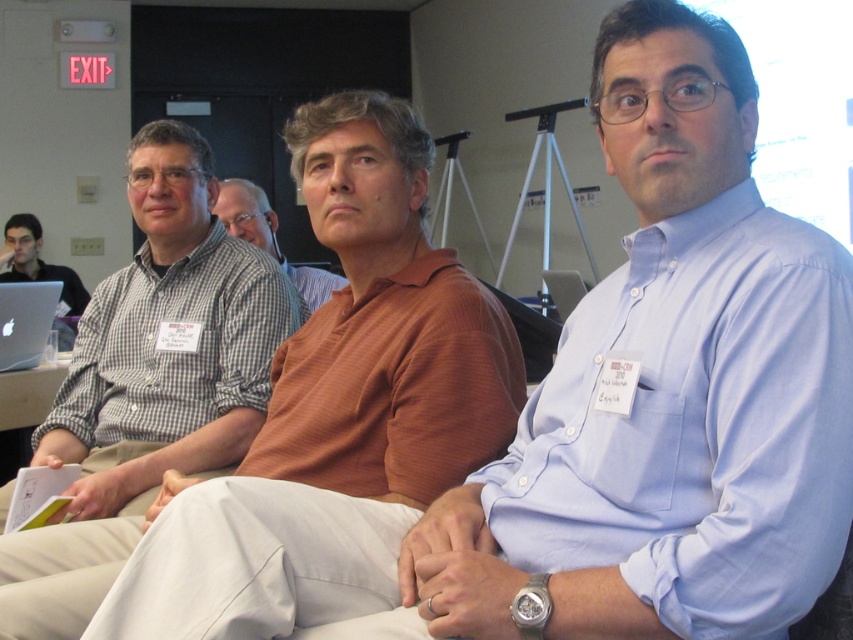
Question: Can you confirm if orange striped shirt at center is positioned to the right of silver metallic laptop at center?

Choices:
 (A) no
 (B) yes

Answer: (A)

Question: Does brown matte shirt at center appear over matte black laptop at left?

Choices:
 (A) yes
 (B) no

Answer: (B)

Question: Observing the image, what is the correct spatial positioning of checkered shirt at left in reference to silver metallic laptop at center?

Choices:
 (A) left
 (B) right

Answer: (A)

Question: Which of these objects is positioned closest to the silver metallic laptop at left?

Choices:
 (A) matte black laptop at left
 (B) brown matte shirt at center

Answer: (B)

Question: Which point is farther from the camera taking this photo?

Choices:
 (A) click(x=160, y=406)
 (B) click(x=73, y=300)
 (C) click(x=393, y=328)

Answer: (B)

Question: Which object is closer to the camera taking this photo?

Choices:
 (A) matte black laptop at left
 (B) orange striped shirt at center
 (C) brown matte shirt at center

Answer: (B)